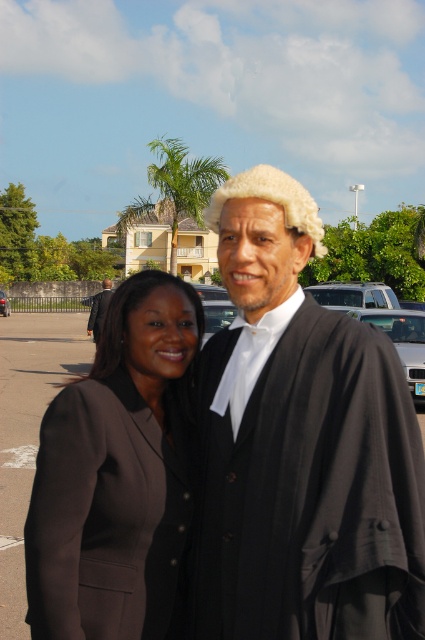
You are standing in the parking lot and want to walk from point A to point B. Point A is at coordinate point[404,364] and point B is at coordinate point[98,333]. Which point is closer to you when you start at point A?

Point A is closer to the viewer than point B, so when you start at point A, point A is already your starting position and point B is further away.

You are a photographer trying to capture a photo of both the person on the right and the person on the left. You are standing at point (404, 330). If you move towards point (418, 586), will the person on the right block the view of the person on the left?

Point (418, 586) is in front of point (404, 330), so moving towards it would place you closer to the person on the right. This might block the view of the person on the left depending on their positions.